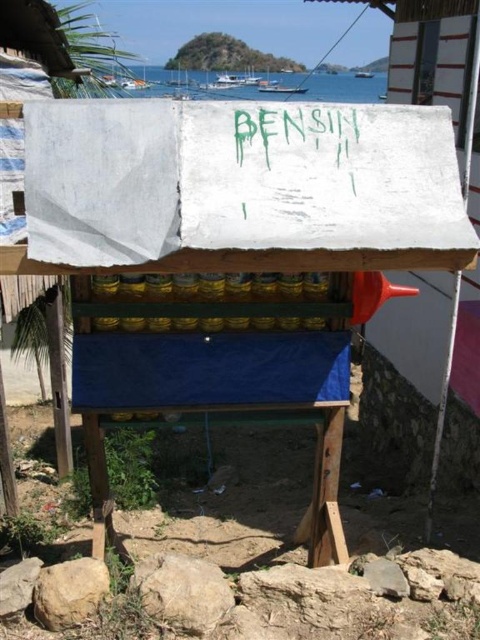
You are a delivery driver who needs to locate the fuel station sign. You see the green painted sign at center and the blue water at upper center. Which object is smaller in size?

The green painted sign at center has a smaller size compared to the blue water at upper center, so the green painted sign at center is smaller.

You are a customer at this fuel station and need to locate the green painted sign at center and the blue water at upper center. Which object is wider?

The blue water at upper center is wider than the green painted sign at center.